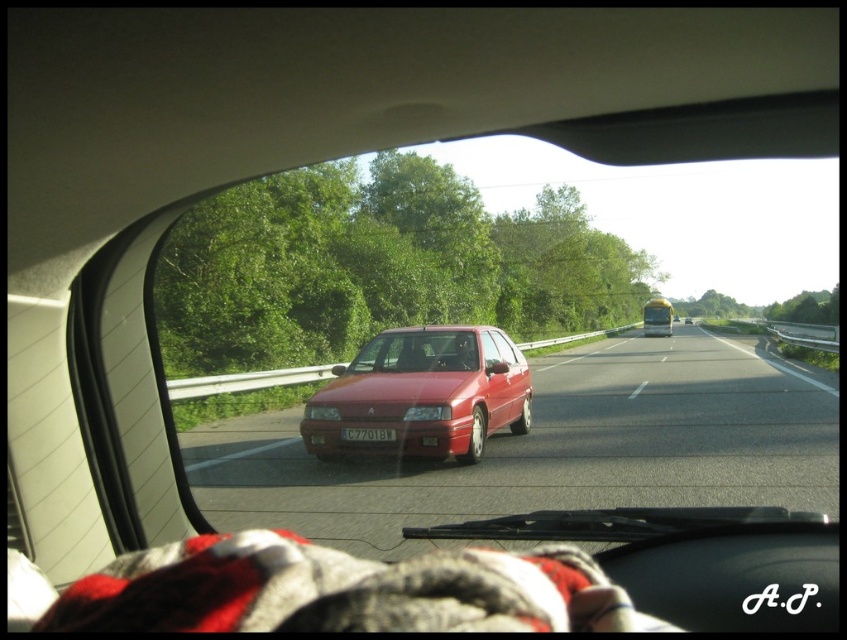
You are driving a car and want to overtake the matte red car at center. Based on the road layout shown in the image, which direction should you turn your steering wheel to stay within the lanes while overtaking?

You should turn the steering wheel to the right to stay within the lanes while overtaking the matte red car at center since the guardrail is on the left side of the road, indicating that the right lane is available for overtaking.

You are driving and need to overtake the glossy red car at center. Based on the road layout described, can you safely pass it on the left side of the road?

The glossy red car at center is positioned at point (555, 449), which is near the left lane divider marked by the metal guardrail. Since overtaking on the left would require crossing into the lane adjacent to the guardrail, which may be narrower or have restricted space, it might not be safe. It is advisable to consider overtaking on the right side if the road conditions permit.

You are driving a car and need to determine the order of two points on the road ahead. The first point is at coordinates point (574, 374) and the second point is at point (403, 417). Based on your current view from the driver seat, which point is closer to you?

Point (403, 417) is closer to you because in the given coordinates, lower y values indicate closer proximity to the driver. Since 0.478 is less than 0.680, point (403, 417) is nearer.